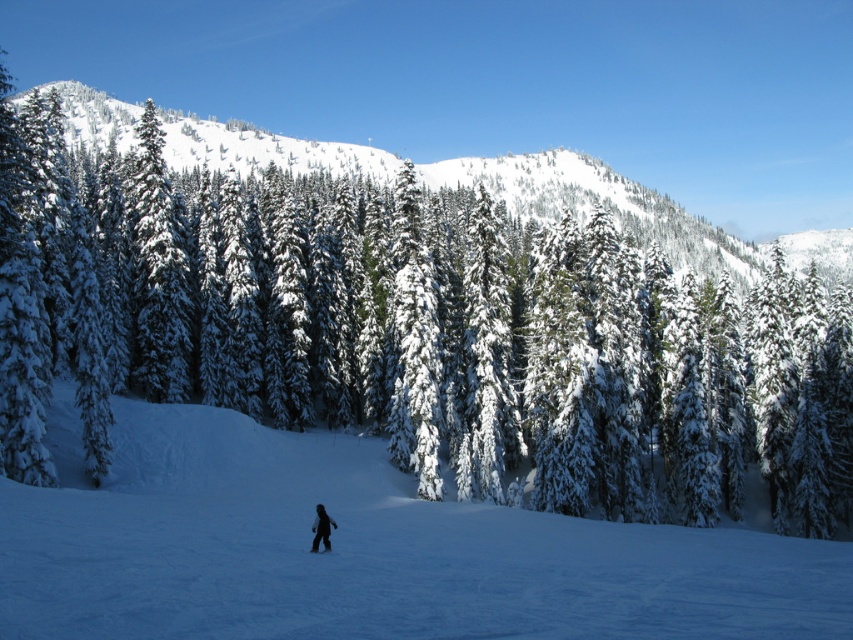
You are planning to build a snowman using the white snow at center and the black matte ski at lower center. Which object would you use as the base of the snowman?

The white snow at center is much taller than the black matte ski at lower center, so you would use the white snow at center as the base of the snowman because it has more material.